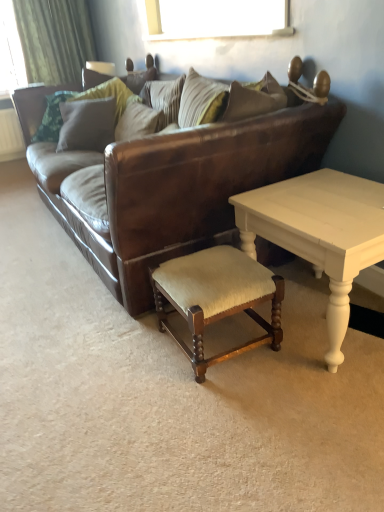
Question: Is wooden upholstered stool at lower center to the right of striped fabric pillow at center, the 2th pillow positioned from the left, from the viewer's perspective?

Choices:
 (A) no
 (B) yes

Answer: (B)

Question: Is wooden upholstered stool at lower center to the left of striped fabric pillow at center, positioned as the 1th pillow in right-to-left order, from the viewer's perspective?

Choices:
 (A) no
 (B) yes

Answer: (A)

Question: Can you confirm if wooden upholstered stool at lower center is bigger than striped fabric pillow at center, the 2th pillow positioned from the left?

Choices:
 (A) no
 (B) yes

Answer: (B)

Question: Can you confirm if wooden upholstered stool at lower center is smaller than striped fabric pillow at center, positioned as the 1th pillow in right-to-left order?

Choices:
 (A) no
 (B) yes

Answer: (A)

Question: Does wooden upholstered stool at lower center have a greater height compared to striped fabric pillow at center, positioned as the 1th pillow in right-to-left order?

Choices:
 (A) no
 (B) yes

Answer: (A)

Question: From a real-world perspective, is wooden upholstered stool at lower center positioned over striped fabric pillow at center, the 2th pillow positioned from the left, based on gravity?

Choices:
 (A) no
 (B) yes

Answer: (A)

Question: Does brown leather couch at center have a lesser width compared to wooden upholstered stool at lower center?

Choices:
 (A) no
 (B) yes

Answer: (A)

Question: Is brown leather couch at center further to camera compared to wooden upholstered stool at lower center?

Choices:
 (A) no
 (B) yes

Answer: (A)

Question: Is brown leather couch at center placed right next to wooden upholstered stool at lower center?

Choices:
 (A) yes
 (B) no

Answer: (B)

Question: Would you say brown leather couch at center is a long distance from wooden upholstered stool at lower center?

Choices:
 (A) no
 (B) yes

Answer: (A)

Question: Is brown leather couch at center positioned with its back to wooden upholstered stool at lower center?

Choices:
 (A) yes
 (B) no

Answer: (B)

Question: From the image's perspective, is brown leather couch at center located beneath wooden upholstered stool at lower center?

Choices:
 (A) yes
 (B) no

Answer: (B)

Question: Does green fabric curtain at upper left have a smaller size compared to brown leather couch at center?

Choices:
 (A) no
 (B) yes

Answer: (B)